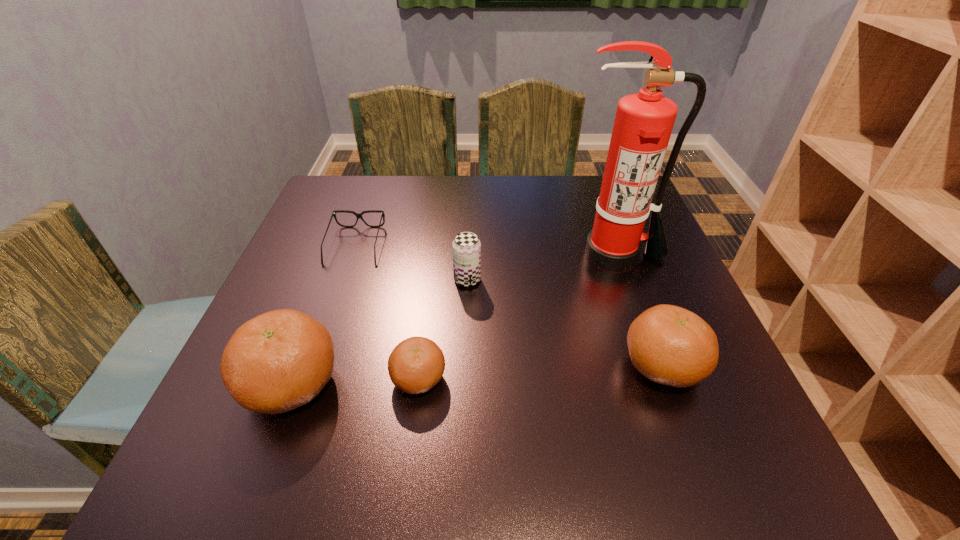
Please determine a free point for an extra clementine to ensure balance. Please provide its 2D coordinates. Your answer should be formatted as a tuple, i.e. [(x, y)], where the tuple contains the x and y coordinates of a point satisfying the conditions above.

[(542, 372)]